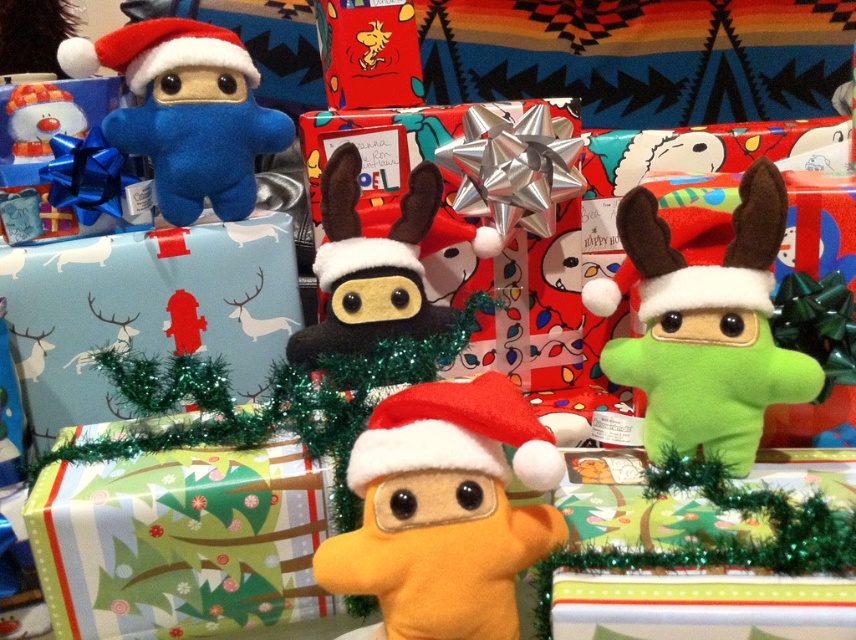
Does orange felt toy at center come in front of felt ninja at center?

Yes, it is.

Between point (395, 461) and point (325, 284), which one is positioned in front?

Point (395, 461) is more forward.

The height and width of the screenshot is (640, 856). Identify the location of orange felt toy at center. (444, 509).

From the picture: Is matte blue plush at upper left wider than red felt santa hat at center?

Yes.

Identify the location of matte blue plush at upper left. (186, 112).

Which is behind, point (223, 211) or point (490, 454)?

The point (223, 211) is more distant.

Identify the location of matte blue plush at upper left. This screenshot has width=856, height=640. (186, 112).

Is orange felt toy at center further to the viewer compared to red felt santa hat at center?

No.

Looking at this image, can you confirm if orange felt toy at center is positioned above red felt santa hat at center?

No, orange felt toy at center is not above red felt santa hat at center.

Identify the location of orange felt toy at center. (444, 509).

Locate an element on the screen. The image size is (856, 640). orange felt toy at center is located at coordinates (444, 509).